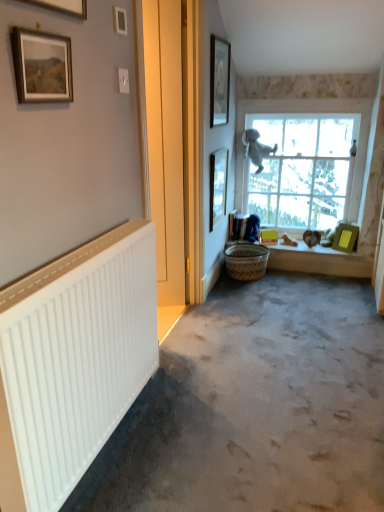
At what (x,y) coordinates should I click in order to perform the action: click on vacant area that is in front of woven brown basket at lower center. Please return your answer as a coordinate pair (x, y). Looking at the image, I should click on (251, 292).